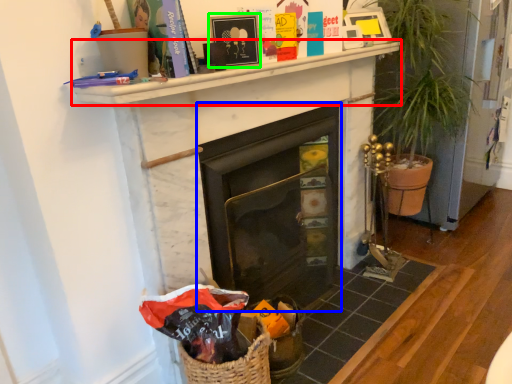
Question: Which is nearer to the mantle (highlighted by a red box)? fireplace (highlighted by a blue box) or picture frame (highlighted by a green box).

Choices:
 (A) fireplace
 (B) picture frame

Answer: (B)